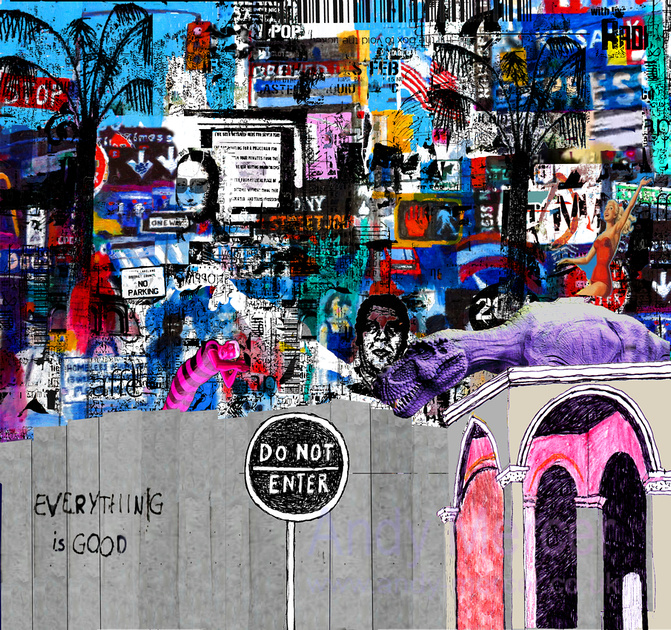
The height and width of the screenshot is (630, 671). I want to click on paint, so click(x=209, y=317).